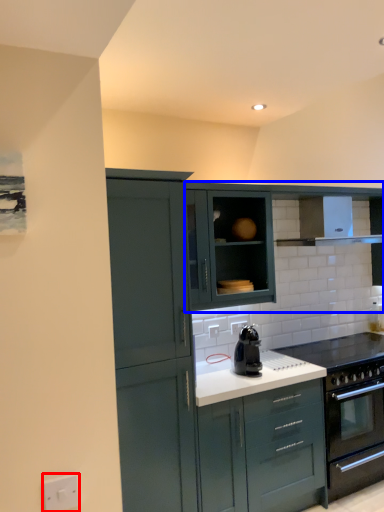
Question: Among these objects, which one is farthest to the camera, electric outlet (highlighted by a red box) or cabinetry (highlighted by a blue box)?

Choices:
 (A) electric outlet
 (B) cabinetry

Answer: (B)